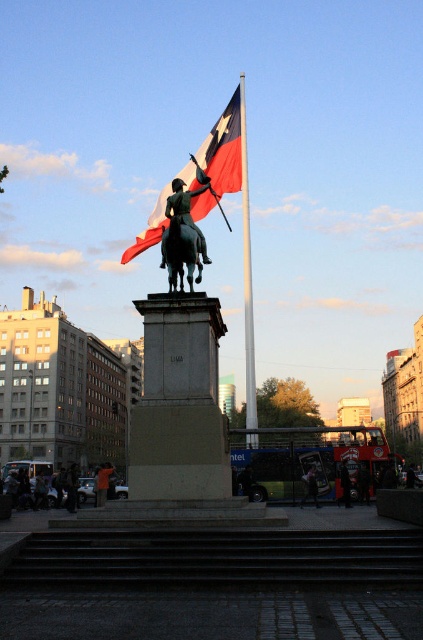
Is red fabric flag at upper center positioned before dark blue jeans at lower center?

Yes.

Between red fabric flag at upper center and dark blue jeans at lower center, which one is positioned higher?

red fabric flag at upper center is above.

Locate an element on the screen. The height and width of the screenshot is (640, 423). red fabric flag at upper center is located at coordinates (217, 160).

Identify the location of red fabric flag at upper center. (217, 160).

The width and height of the screenshot is (423, 640). What do you see at coordinates (102, 483) in the screenshot? I see `orange cloth at center` at bounding box center [102, 483].

How much distance is there between orange cloth at center and dark blue jeans at lower center?

orange cloth at center is 24.96 meters from dark blue jeans at lower center.

Where is `orange cloth at center`? orange cloth at center is located at coordinates (102, 483).

Identify the location of orange cloth at center. The image size is (423, 640). (102, 483).

Which is in front, point (250, 296) or point (99, 492)?

Point (99, 492) is in front.

In the scene shown: Who is more distant from viewer, (241, 115) or (98, 490)?

The point (241, 115) is more distant.

Which is in front, point (247, 218) or point (109, 472)?

Positioned in front is point (109, 472).

Where is `silver metallic flag pole at center`? This screenshot has width=423, height=640. silver metallic flag pole at center is located at coordinates coord(247,282).